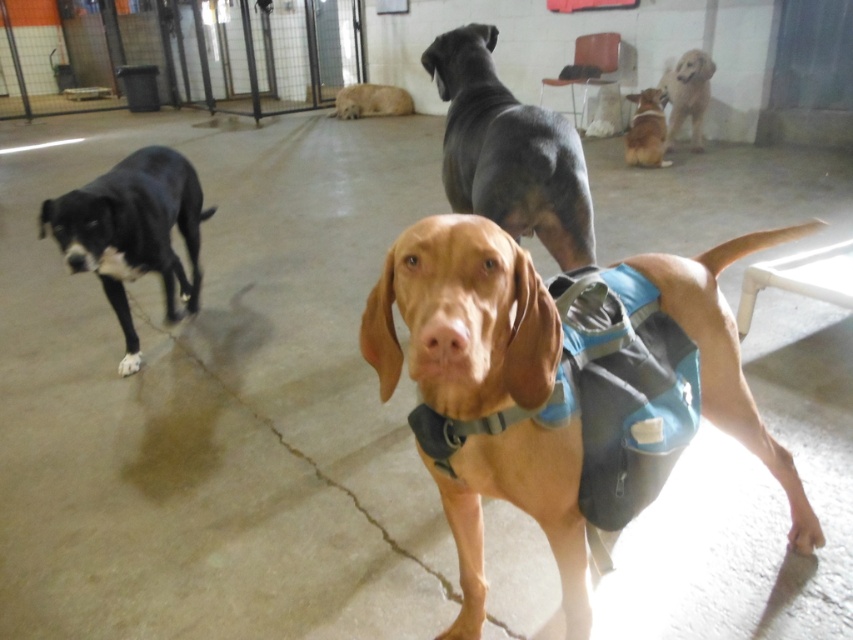
Question: Considering the real-world distances, which object is closest to the black smooth fur dog at left?

Choices:
 (A) light brown fur at center
 (B) brown suede dog at upper center
 (C) smooth black dog at center
 (D) golden fur dog at upper right

Answer: (C)

Question: Where is smooth black dog at center located in relation to black smooth fur dog at left in the image?

Choices:
 (A) above
 (B) below

Answer: (A)

Question: Which of the following is the farthest from the observer?

Choices:
 (A) brown suede dog at upper center
 (B) smooth black dog at center

Answer: (A)

Question: Is golden fur dog at upper right smaller than brown suede dog at upper center?

Choices:
 (A) no
 (B) yes

Answer: (A)

Question: Among these objects, which one is nearest to the camera?

Choices:
 (A) light brown fur at center
 (B) black smooth fur dog at left

Answer: (B)

Question: Can you confirm if black smooth fur dog at left is wider than brown suede dog at upper center?

Choices:
 (A) no
 (B) yes

Answer: (A)